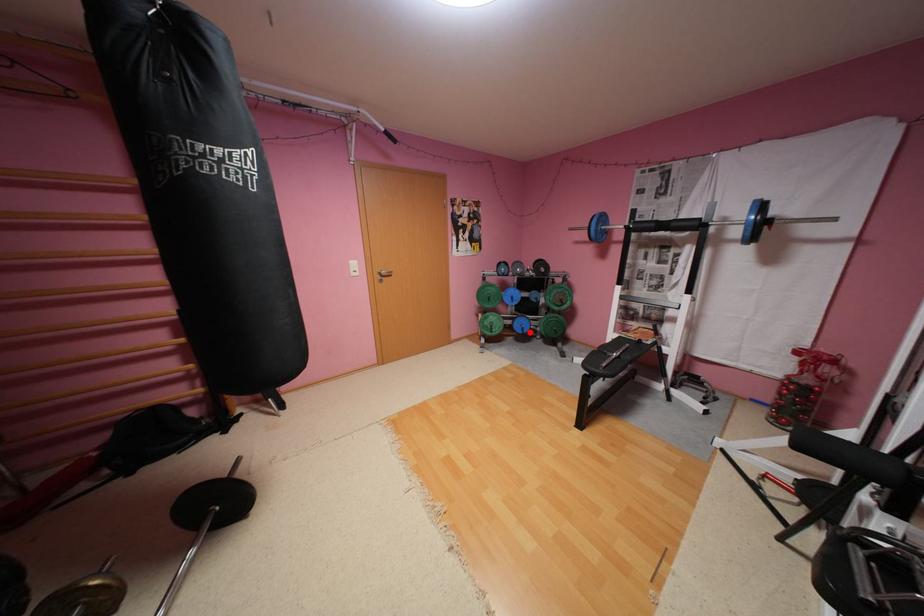
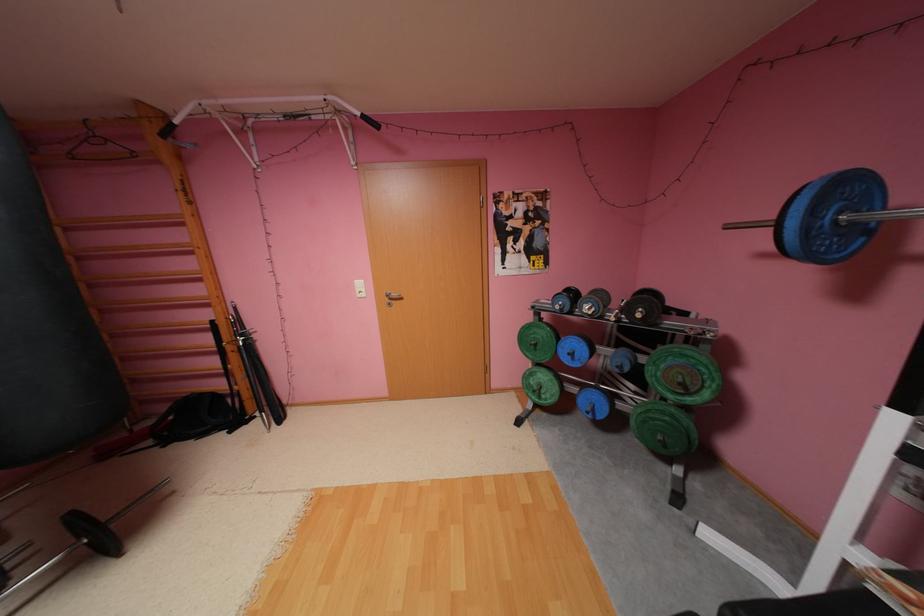
Question: I am providing you with two images of the same scene from different viewpoints. Image1 has a red point marked. In image2, the corresponding 3D location appears at what relative position? Reply with the corresponding letter.

Choices:
 (A) Closer
 (B) Farther

Answer: (B)